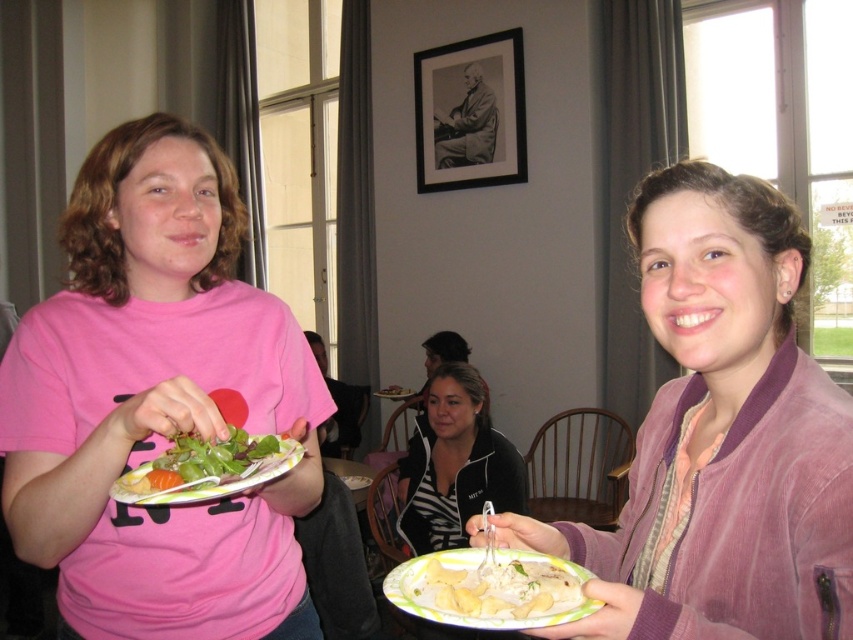
Question: Can you confirm if pink matte shirt at center is wider than white paper plate at lower center?

Choices:
 (A) no
 (B) yes

Answer: (B)

Question: Is matte purple jacket at right further to the viewer compared to matte plastic plate at center?

Choices:
 (A) yes
 (B) no

Answer: (B)

Question: Which of the following is the closest to the observer?

Choices:
 (A) (132, 301)
 (B) (302, 454)
 (C) (781, 285)
 (D) (434, 595)

Answer: (D)

Question: Which point appears closest to the camera in this image?

Choices:
 (A) (495, 627)
 (B) (260, 476)
 (C) (7, 358)
 (D) (720, 323)

Answer: (A)

Question: Which point is farther from the camera taking this photo?

Choices:
 (A) (485, 589)
 (B) (236, 486)

Answer: (B)

Question: Does matte purple jacket at right have a larger size compared to white paper plate at lower center?

Choices:
 (A) yes
 (B) no

Answer: (A)